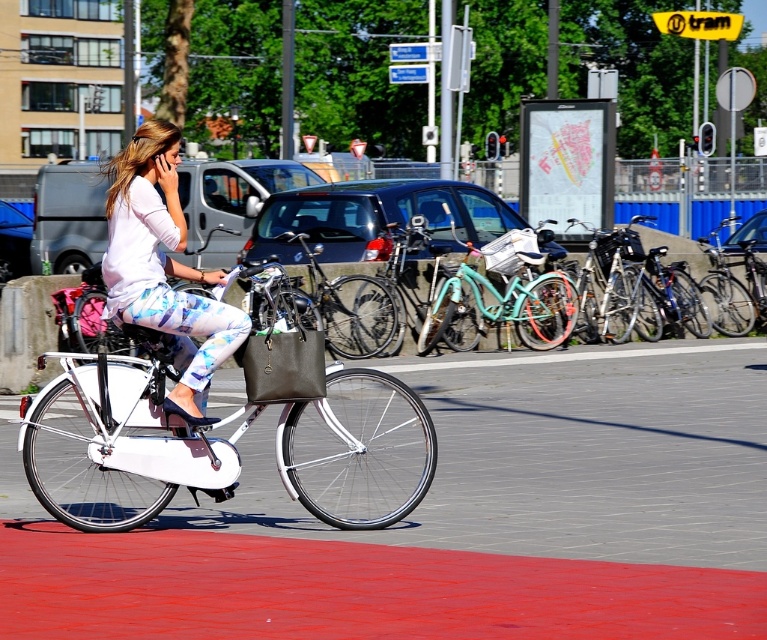
You are a delivery person who needs to park your bike between two bicycles in the scene. The two bicycles are the white matte bicycle at center and the matte white bicycle at center. Which bicycle should you place your bike to the right of?

You should place your bike to the right of the matte white bicycle at center because the white matte bicycle at center is already positioned on the right side of it.